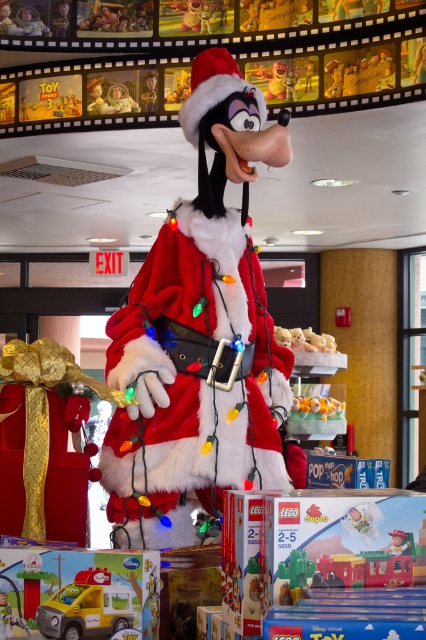
You are a customer in the store and want to take a photo of the Goofy mascot and the velvet red gift at center. The camera you are using has a maximum focus range of 2.5 meters. Can you capture both subjects in focus without moving your position?

The velvet red gift at center is 2.67 meters from camera, which exceeds the camera maximum focus range of 2.5 meters. Therefore, you cannot capture both subjects in focus without moving your position.

You are a customer in the store and want to pick up the velvet red gift at center and the yellow plastic toy truck at lower left. Which item will you reach first if you approach from the front of the store?

The velvet red gift at center will be reached first because it is closer to you than the yellow plastic toy truck at lower left, which is further away.